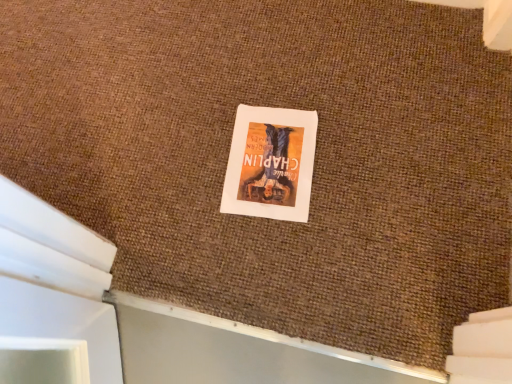
Find the location of a particular element. free space underneath matte paper poster at center (from a real-world perspective) is located at coordinates (271, 159).